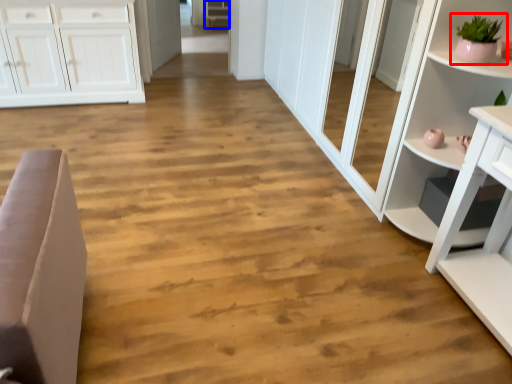
Question: Which object is closer to the camera taking this photo, houseplant (highlighted by a red box) or cabinetry (highlighted by a blue box)?

Choices:
 (A) houseplant
 (B) cabinetry

Answer: (A)